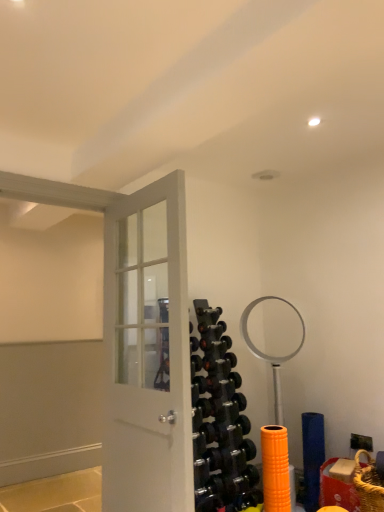
Question: Is black rubber dumbbell at center, placed as the 2th dumbbell when sorted from bottom to top, beside black rubber dumbbell at center, acting as the 3th dumbbell starting from the bottom?

Choices:
 (A) no
 (B) yes

Answer: (B)

Question: Is black rubber dumbbell at center, acting as the 3th dumbbell starting from the bottom, surrounded by black rubber dumbbell at center, placed as the 2th dumbbell when sorted from bottom to top?

Choices:
 (A) no
 (B) yes

Answer: (A)

Question: Considering the relative positions of black rubber dumbbell at center, placed as the 2th dumbbell when sorted from bottom to top, and black rubber dumbbell at center, acting as the 3th dumbbell starting from the bottom, in the image provided, is black rubber dumbbell at center, placed as the 2th dumbbell when sorted from bottom to top, to the left of black rubber dumbbell at center, acting as the 3th dumbbell starting from the bottom, from the viewer's perspective?

Choices:
 (A) yes
 (B) no

Answer: (B)

Question: Is black rubber dumbbell at center, the 2th dumbbell in the top-to-bottom sequence, wider than black rubber dumbbell at center, which is counted as the first dumbbell, starting from the top?

Choices:
 (A) no
 (B) yes

Answer: (B)

Question: Is black rubber dumbbell at center, the 2th dumbbell in the top-to-bottom sequence, facing away from black rubber dumbbell at center, which is counted as the first dumbbell, starting from the top?

Choices:
 (A) no
 (B) yes

Answer: (A)

Question: Does black rubber dumbbell at center, the 2th dumbbell in the top-to-bottom sequence, lie behind black rubber dumbbell at center, acting as the 3th dumbbell starting from the bottom?

Choices:
 (A) yes
 (B) no

Answer: (B)

Question: From a real-world perspective, is black rubber dumbbell at center, the 2th dumbbell in the top-to-bottom sequence, located higher than black rubber dumbbell at center, arranged as the 3th dumbbell when viewed from the top?

Choices:
 (A) yes
 (B) no

Answer: (A)

Question: Is black rubber dumbbell at center, the 2th dumbbell in the top-to-bottom sequence, aimed at black rubber dumbbell at center, which is counted as the first dumbbell, starting from the bottom?

Choices:
 (A) no
 (B) yes

Answer: (A)

Question: Is black rubber dumbbell at center, arranged as the 3th dumbbell when viewed from the top, a part of black rubber dumbbell at center, the 2th dumbbell in the top-to-bottom sequence?

Choices:
 (A) no
 (B) yes

Answer: (A)

Question: Does black rubber dumbbell at center, the 2th dumbbell in the top-to-bottom sequence, have a larger size compared to black rubber dumbbell at center, arranged as the 3th dumbbell when viewed from the top?

Choices:
 (A) yes
 (B) no

Answer: (B)

Question: From the image's perspective, is black rubber dumbbell at center, placed as the 2th dumbbell when sorted from bottom to top, located beneath black rubber dumbbell at center, which is counted as the first dumbbell, starting from the bottom?

Choices:
 (A) no
 (B) yes

Answer: (A)

Question: Can you confirm if black rubber dumbbell at center, the 2th dumbbell in the top-to-bottom sequence, is smaller than black rubber dumbbell at center, arranged as the 3th dumbbell when viewed from the top?

Choices:
 (A) yes
 (B) no

Answer: (A)

Question: Can you confirm if black rubber dumbbell at center, which is counted as the first dumbbell, starting from the bottom, is positioned to the left of black rubber dumbbell at center, acting as the 3th dumbbell starting from the bottom?

Choices:
 (A) no
 (B) yes

Answer: (A)